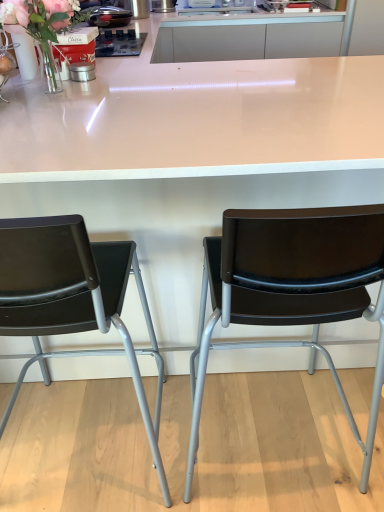
The image size is (384, 512). I want to click on vacant point to the right of translucent glass vase at upper left, so click(124, 83).